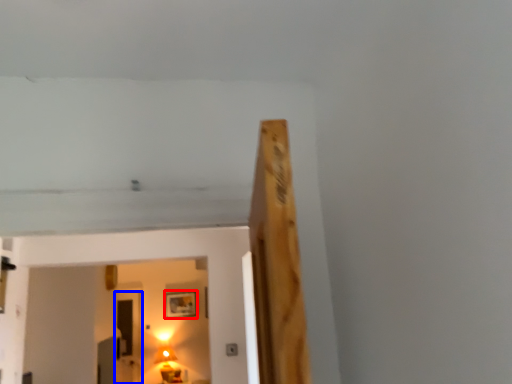
Question: Among these objects, which one is farthest to the camera, picture frame (highlighted by a red box) or glass door (highlighted by a blue box)?

Choices:
 (A) picture frame
 (B) glass door

Answer: (A)